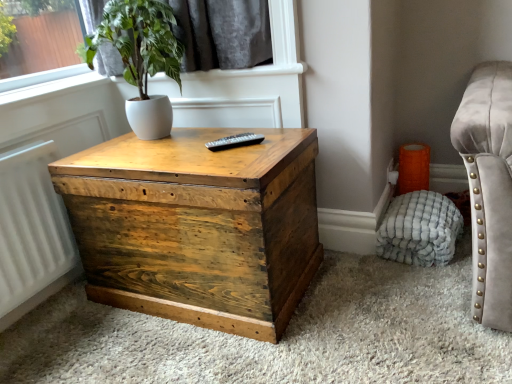
Question: From a real-world perspective, is wooden trunk at center over white matte pot at upper left?

Choices:
 (A) no
 (B) yes

Answer: (A)

Question: Is wooden trunk at center surrounding white matte pot at upper left?

Choices:
 (A) no
 (B) yes

Answer: (A)

Question: Is wooden trunk at center in contact with white matte pot at upper left?

Choices:
 (A) no
 (B) yes

Answer: (A)

Question: Considering the relative sizes of wooden trunk at center and white matte pot at upper left in the image provided, is wooden trunk at center bigger than white matte pot at upper left?

Choices:
 (A) yes
 (B) no

Answer: (A)

Question: Does wooden trunk at center appear on the left side of white matte pot at upper left?

Choices:
 (A) yes
 (B) no

Answer: (B)

Question: Would you say white textured pouf at lower right is to the left or to the right of white matte pot at upper left in the picture?

Choices:
 (A) right
 (B) left

Answer: (A)

Question: From the image's perspective, relative to white matte pot at upper left, is white textured pouf at lower right above or below?

Choices:
 (A) below
 (B) above

Answer: (A)

Question: Considering the positions of white textured pouf at lower right and white matte pot at upper left in the image, is white textured pouf at lower right taller or shorter than white matte pot at upper left?

Choices:
 (A) short
 (B) tall

Answer: (A)

Question: From a real-world perspective, relative to white matte pot at upper left, is white textured pouf at lower right vertically above or below?

Choices:
 (A) above
 (B) below

Answer: (B)

Question: Is black plastic remote at center taller or shorter than white matte pot at upper left?

Choices:
 (A) short
 (B) tall

Answer: (A)

Question: From a real-world perspective, is black plastic remote at center positioned above or below white matte pot at upper left?

Choices:
 (A) above
 (B) below

Answer: (B)

Question: From the image's perspective, is black plastic remote at center above or below white matte pot at upper left?

Choices:
 (A) below
 (B) above

Answer: (A)

Question: Looking at their shapes, would you say black plastic remote at center is wider or thinner than white matte pot at upper left?

Choices:
 (A) wide
 (B) thin

Answer: (B)

Question: From a real-world perspective, is wooden trunk at center physically located above or below white textured pouf at lower right?

Choices:
 (A) below
 (B) above

Answer: (B)

Question: In terms of size, does wooden trunk at center appear bigger or smaller than white textured pouf at lower right?

Choices:
 (A) big
 (B) small

Answer: (A)